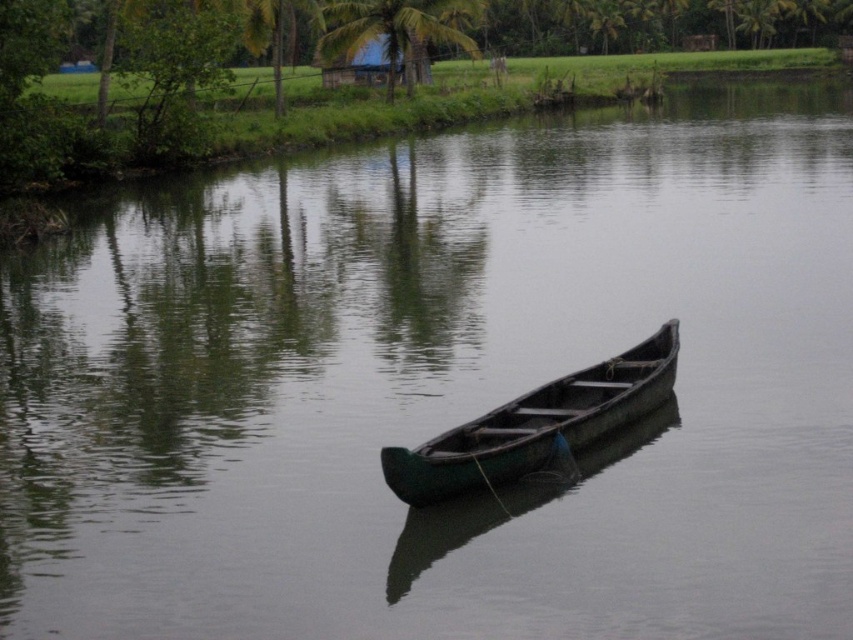
Based on the photo, is green wooden canoe at center positioned in front of green leafy palm tree at upper center?

Yes.

Which is behind, point (654, 372) or point (326, 10)?

The point (326, 10) is behind.

Identify the location of green wooden canoe at center. (537, 424).